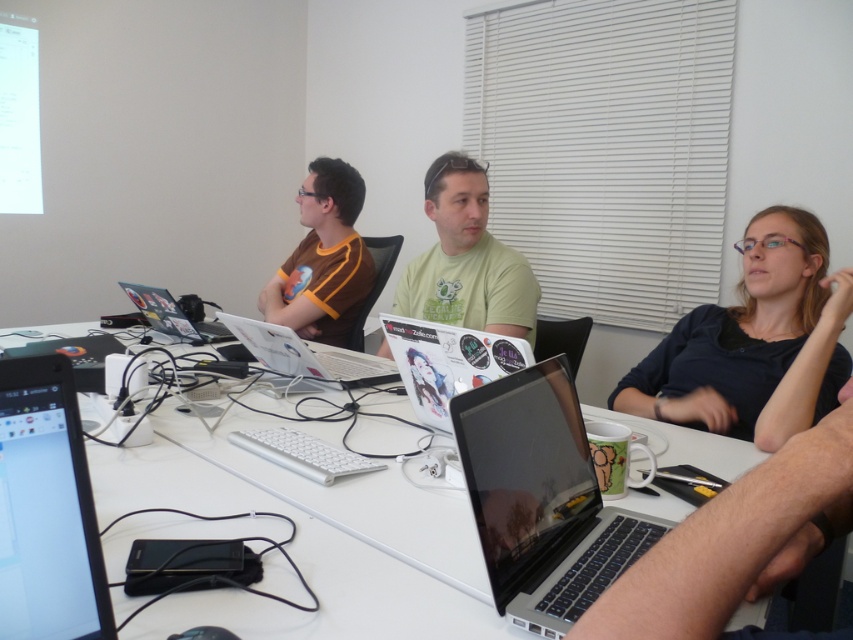
Image resolution: width=853 pixels, height=640 pixels. Describe the element at coordinates (309, 538) in the screenshot. I see `white glossy table at center` at that location.

Who is more forward, (350, 595) or (96, 557)?

Point (96, 557) is in front.

This screenshot has width=853, height=640. What do you see at coordinates (309, 538) in the screenshot?
I see `white glossy table at center` at bounding box center [309, 538].

Find the location of a particular element. Image resolution: width=853 pixels, height=640 pixels. white glossy table at center is located at coordinates (309, 538).

Is white glossy table at center behind white glossy laptop at center?

No.

Can you confirm if white glossy table at center is shorter than white glossy laptop at center?

No, white glossy table at center is not shorter than white glossy laptop at center.

Is point (306, 595) farther from viewer compared to point (347, 371)?

No, it is in front of (347, 371).

Where is `white glossy table at center`? This screenshot has width=853, height=640. white glossy table at center is located at coordinates (309, 538).

From the picture: Is silver metallic laptop at center taller than white glossy laptop at center?

Correct, silver metallic laptop at center is much taller as white glossy laptop at center.

Identify the location of silver metallic laptop at center. This screenshot has width=853, height=640. (543, 499).

You are a GUI agent. You are given a task and a screenshot of the screen. Output one action in this format:
    pyautogui.click(x=<x>, y=<y>)
    Task: Click on the silver metallic laptop at center
    This screenshot has height=640, width=853.
    Given the screenshot: What is the action you would take?
    pyautogui.click(x=543, y=499)